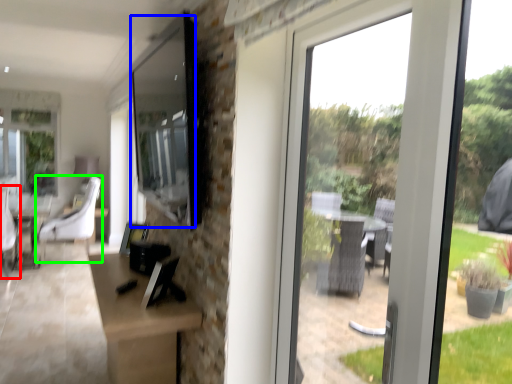
Question: Which object is positioned closest to swivel chair (highlighted by a red box)? Select from window screen (highlighted by a blue box) and chair (highlighted by a green box).

Choices:
 (A) window screen
 (B) chair

Answer: (B)